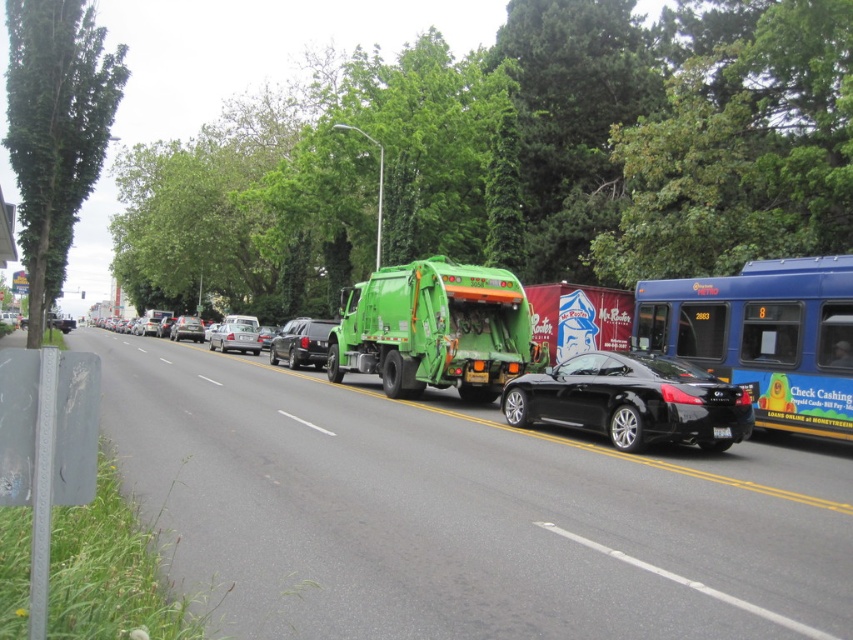
You are a pedestrian standing at the crosswalk. You see the green rubber garbage truck at center and the shiny silver sedan at center. Which vehicle is closer to you?

The green rubber garbage truck at center is closer to you because it is in front of the shiny silver sedan at center.

You are a delivery driver who needs to park your delivery van, which is the same size as the shiny black suv at center, in a parking spot that can only accommodate vehicles the size of the satin silver sedan at center. Can your van fit in the parking spot?

The shiny black suv at center is bigger than the satin silver sedan at center, so the delivery van cannot fit in the parking spot designed for the smaller sedan.

You are standing at the camera position and want to cross the road to the green garbage truck on the left. The road has a yellow dividing line. Is the shiny black suv at center blocking your path?

The shiny black suv at center is 72.88 feet away from you. Since the suv is at the center of the road, it would block your path to the green garbage truck on the left side of the road.